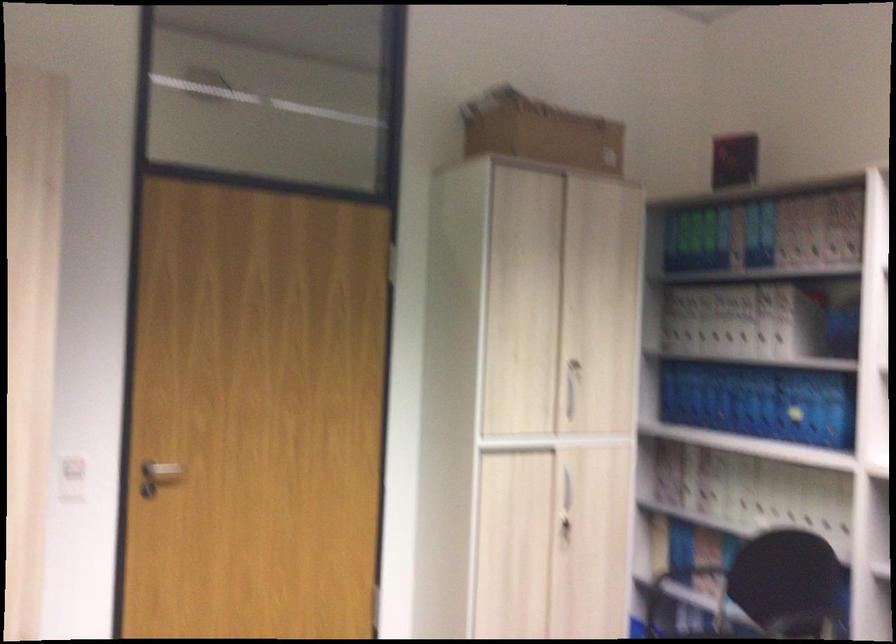
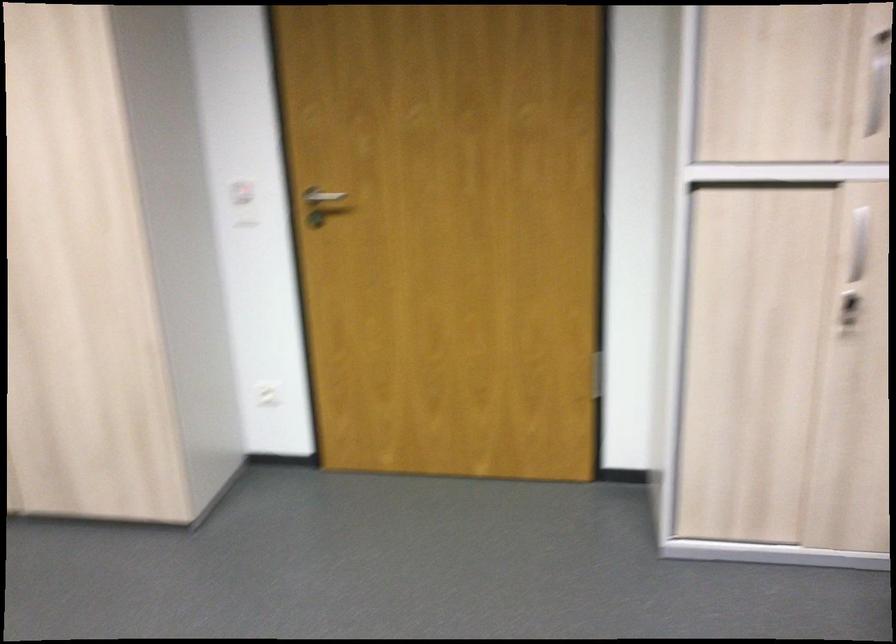
In the second image, find the point that corresponds to pixel 143 468 in the first image.

(321, 204)